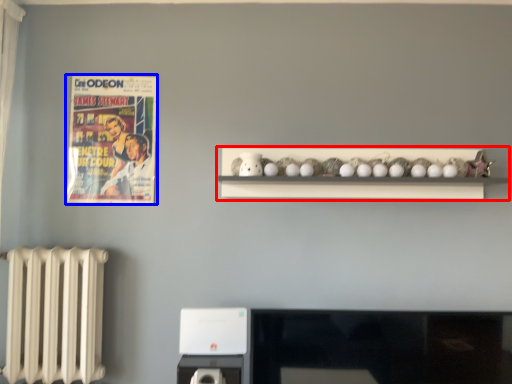
Question: Among these objects, which one is nearest to the camera, shelf (highlighted by a red box) or comic book (highlighted by a blue box)?

Choices:
 (A) shelf
 (B) comic book

Answer: (A)